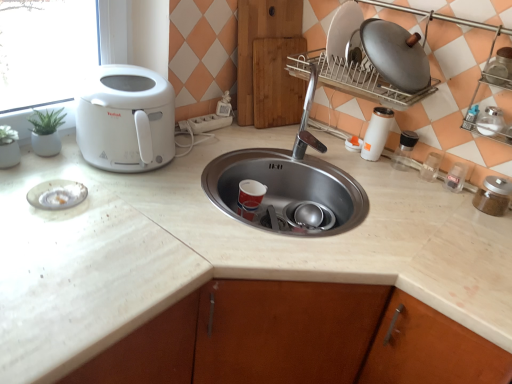
Identify the location of vacant space situated on the left part of clear glass bottle at right, which ranks as the third appliance in left-to-right order. (347, 155).